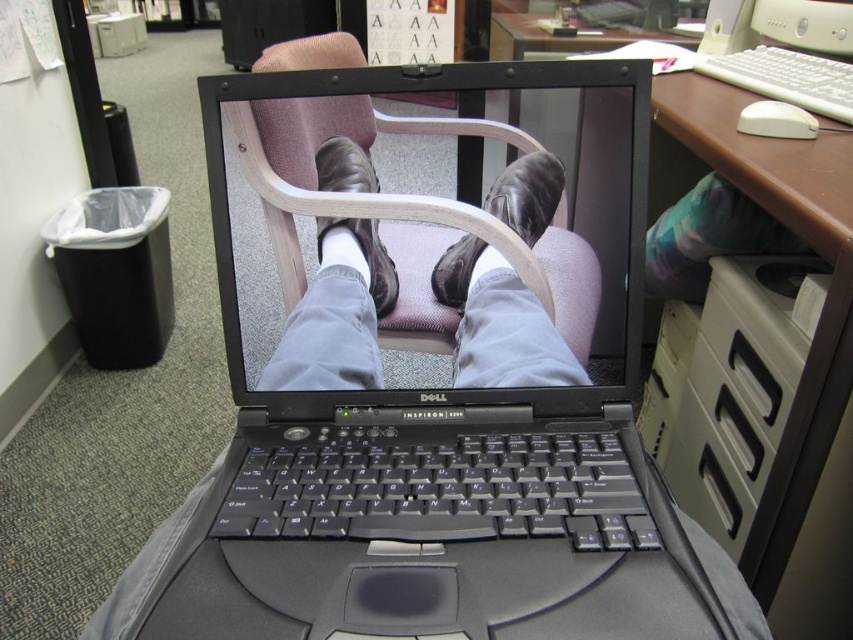
From the picture: Is black plastic laptop at center taller than leather at center?

Yes.

Where is `black plastic laptop at center`? Image resolution: width=853 pixels, height=640 pixels. black plastic laptop at center is located at coordinates (434, 385).

Does black matte laptop at center have a greater width compared to brown leather shoe at center?

Yes, black matte laptop at center is wider than brown leather shoe at center.

What do you see at coordinates (430, 228) in the screenshot?
I see `black matte laptop at center` at bounding box center [430, 228].

Is point (277, 99) closer to viewer compared to point (335, 220)?

Yes, it is.

Locate an element on the screen. The width and height of the screenshot is (853, 640). black matte laptop at center is located at coordinates (430, 228).

Is point (781, 513) farther from viewer compared to point (548, 189)?

Yes, point (781, 513) is behind point (548, 189).

Which of these two, wooden desk at upper right or leather at center, stands shorter?

With less height is leather at center.

The height and width of the screenshot is (640, 853). Find the location of `wooden desk at upper right`. wooden desk at upper right is located at coordinates (773, 436).